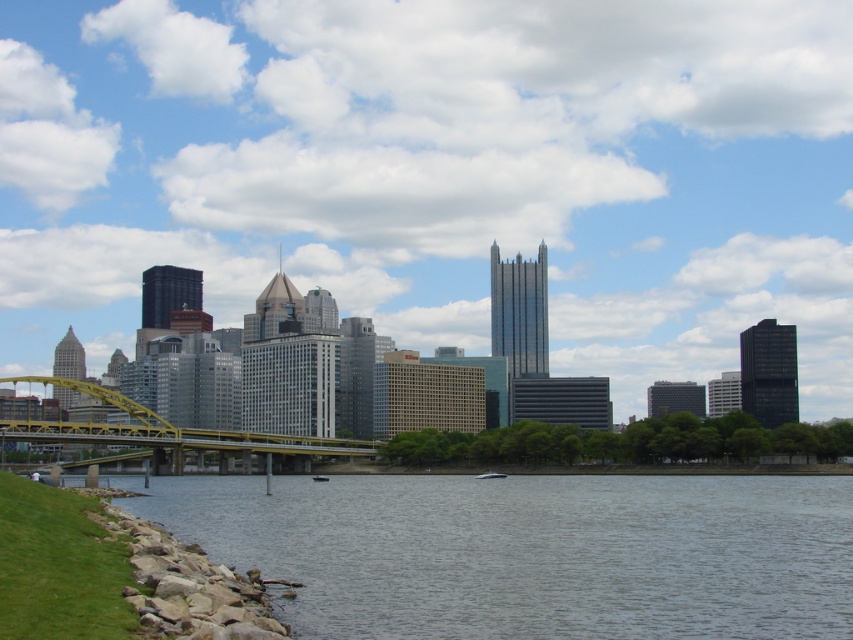
Question: Is transparent glass bridge at center positioned in front of yellow metallic bridge at center?

Choices:
 (A) no
 (B) yes

Answer: (A)

Question: Which point is farther to the camera?

Choices:
 (A) gray smooth water at lower left
 (B) yellow metallic bridge at center
 (C) transparent glass bridge at center

Answer: (C)

Question: Does transparent glass bridge at center come behind gray smooth water at lower left?

Choices:
 (A) no
 (B) yes

Answer: (B)

Question: Which point is farther to the camera?

Choices:
 (A) transparent glass bridge at center
 (B) yellow metallic bridge at center

Answer: (A)

Question: Is transparent glass bridge at center bigger than yellow metallic bridge at center?

Choices:
 (A) no
 (B) yes

Answer: (B)

Question: Based on their relative distances, which object is nearer to the transparent glass bridge at center?

Choices:
 (A) gray smooth water at lower left
 (B) yellow metallic bridge at center

Answer: (B)